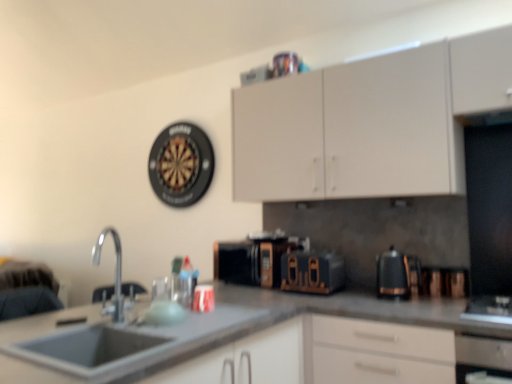
Question: Is black matte microwave at center, which appears as the 2th appliance when viewed from the right, closer to the viewer compared to black plastic coffee pot at right?

Choices:
 (A) no
 (B) yes

Answer: (A)

Question: From a real-world perspective, is black matte microwave at center, which appears as the 2th appliance when viewed from the right, located beneath black plastic coffee pot at right?

Choices:
 (A) yes
 (B) no

Answer: (B)

Question: Considering the relative sizes of black matte microwave at center, which appears as the 2th appliance when viewed from the right, and black plastic coffee pot at right in the image provided, is black matte microwave at center, which appears as the 2th appliance when viewed from the right, smaller than black plastic coffee pot at right?

Choices:
 (A) yes
 (B) no

Answer: (B)

Question: Is black matte microwave at center, acting as the 1th appliance starting from the left, far from black plastic coffee pot at right?

Choices:
 (A) yes
 (B) no

Answer: (B)

Question: Is the depth of black matte microwave at center, acting as the 1th appliance starting from the left, greater than that of black plastic coffee pot at right?

Choices:
 (A) no
 (B) yes

Answer: (B)

Question: Is black plastic coffee pot at right a part of black matte microwave at center, which appears as the 2th appliance when viewed from the right?

Choices:
 (A) no
 (B) yes

Answer: (A)

Question: Does black matte microwave at center, which appears as the 2th appliance when viewed from the right, have a lesser width compared to smooth gray countertop at center?

Choices:
 (A) no
 (B) yes

Answer: (B)

Question: Can you confirm if black matte microwave at center, acting as the 1th appliance starting from the left, is shorter than smooth gray countertop at center?

Choices:
 (A) no
 (B) yes

Answer: (B)

Question: Does black matte microwave at center, which appears as the 2th appliance when viewed from the right, appear on the left side of smooth gray countertop at center?

Choices:
 (A) yes
 (B) no

Answer: (A)

Question: From a real-world perspective, is black matte microwave at center, acting as the 1th appliance starting from the left, physically above smooth gray countertop at center?

Choices:
 (A) yes
 (B) no

Answer: (A)

Question: Are black matte microwave at center, acting as the 1th appliance starting from the left, and smooth gray countertop at center making contact?

Choices:
 (A) yes
 (B) no

Answer: (B)

Question: Could you tell me if black matte microwave at center, acting as the 1th appliance starting from the left, is facing smooth gray countertop at center?

Choices:
 (A) yes
 (B) no

Answer: (B)

Question: Does silver metallic faucet at lower left have a greater height compared to white matte cabinet at upper center?

Choices:
 (A) no
 (B) yes

Answer: (A)